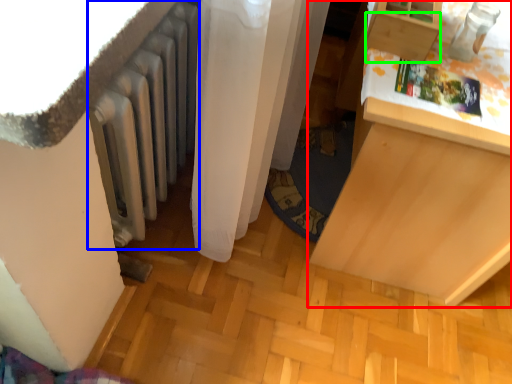
Question: Which object is the farthest from furniture (highlighted by a red box)? Choose among these: radiator (highlighted by a blue box) or drawer (highlighted by a green box).

Choices:
 (A) radiator
 (B) drawer

Answer: (A)